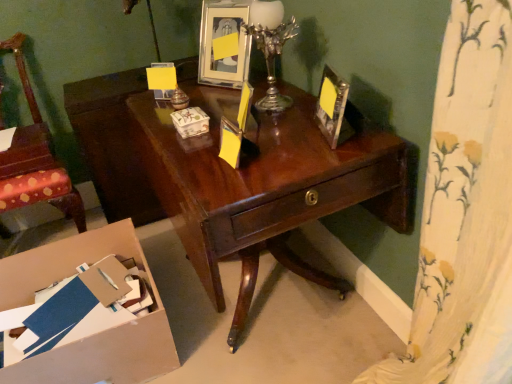
I want to click on vacant space situated on the left part of metallic silver picture frame at upper right, acting as the second picture frame starting from the top, so click(x=288, y=137).